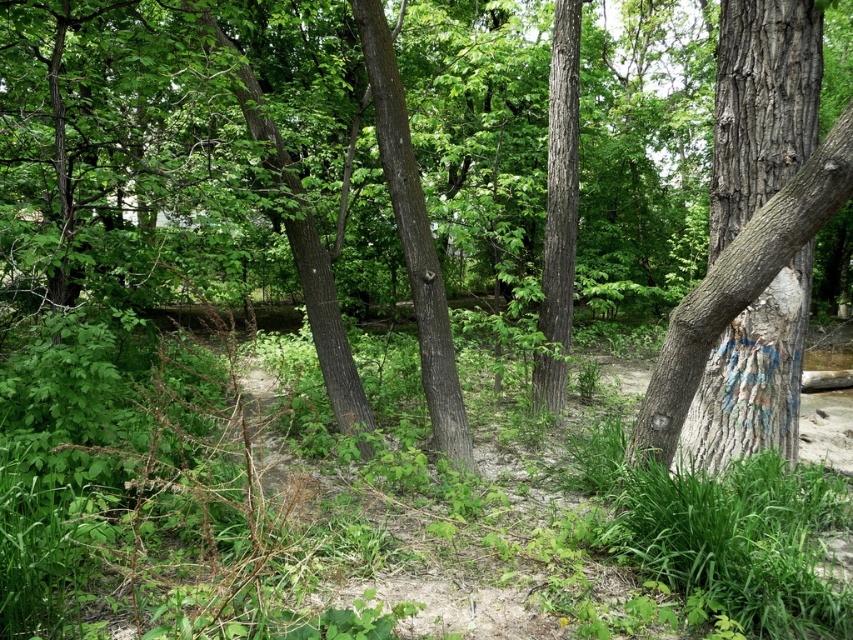
Question: Considering the real-world distances, which object is closest to the smooth bark tree trunk at center?

Choices:
 (A) smooth brown tree trunk at center
 (B) smooth gray bark tree at right

Answer: (B)

Question: Is smooth bark tree trunk at center in front of smooth brown tree trunk at center?

Choices:
 (A) no
 (B) yes

Answer: (B)

Question: Which object is positioned closest to the smooth brown tree trunk at center?

Choices:
 (A) smooth bark tree trunk at center
 (B) smooth gray bark tree at right

Answer: (A)

Question: Which point is closer to the camera taking this photo?

Choices:
 (A) (445, 344)
 (B) (844, 157)
 (C) (570, 100)

Answer: (B)

Question: Does smooth bark tree trunk at center have a greater width compared to smooth brown tree trunk at center?

Choices:
 (A) yes
 (B) no

Answer: (A)

Question: In this image, where is smooth gray bark tree at right located relative to smooth brown tree trunk at center?

Choices:
 (A) above
 (B) below

Answer: (B)